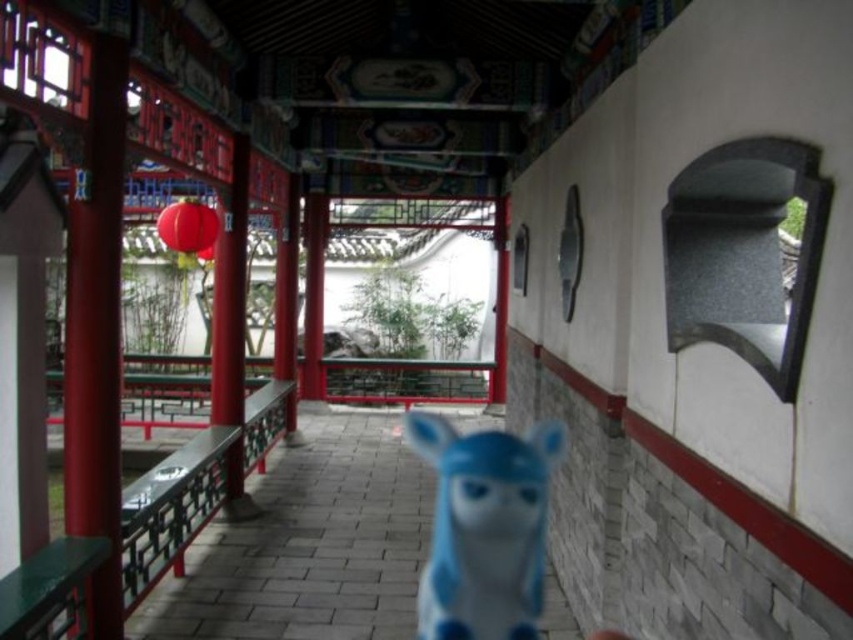
Which of these two, smooth glossy red pillar at center left or matte red paper lantern at upper left, stands taller?

Standing taller between the two is smooth glossy red pillar at center left.

Which is behind, point (230, 497) or point (207, 224)?

The point (230, 497) is more distant.

The height and width of the screenshot is (640, 853). Find the location of `smooth glossy red pillar at center left`. smooth glossy red pillar at center left is located at coordinates (230, 294).

This screenshot has height=640, width=853. Describe the element at coordinates (485, 529) in the screenshot. I see `blue matte toy at center` at that location.

Is blue matte toy at center taller than matte red paper lantern at upper left?

Yes.

Is point (500, 465) farther from viewer compared to point (180, 243)?

Yes, it is behind point (180, 243).

Where is `blue matte toy at center`? The width and height of the screenshot is (853, 640). blue matte toy at center is located at coordinates (485, 529).

Looking at this image, who is shorter, blue matte toy at center or smooth glossy red pillar at center left?

Standing shorter between the two is blue matte toy at center.

Which is in front, point (456, 588) or point (239, 419)?

Point (456, 588) is in front.

Locate an element on the screen. This screenshot has width=853, height=640. blue matte toy at center is located at coordinates (485, 529).